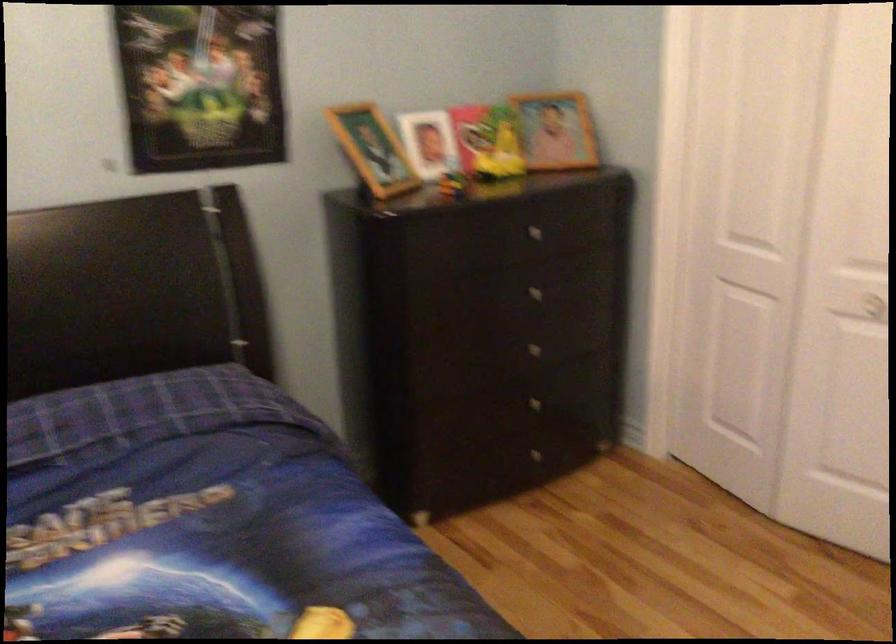
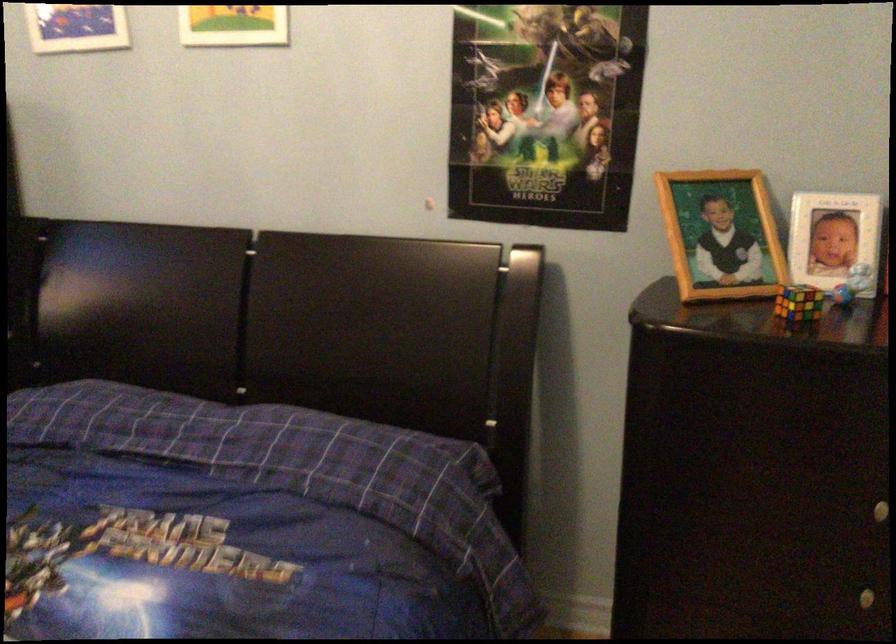
Find the pixel in the second image that matches (451,164) in the first image.

(851, 283)